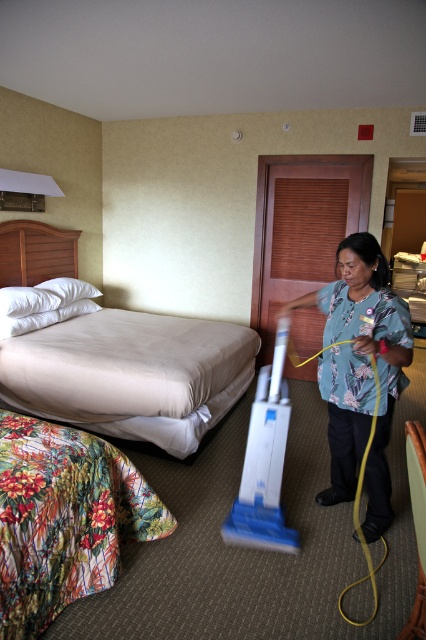
The height and width of the screenshot is (640, 426). Describe the element at coordinates (127, 369) in the screenshot. I see `beige fabric bed at left` at that location.

Is point (201, 371) less distant than point (348, 440)?

No.

Locate an element on the screen. beige fabric bed at left is located at coordinates (127, 369).